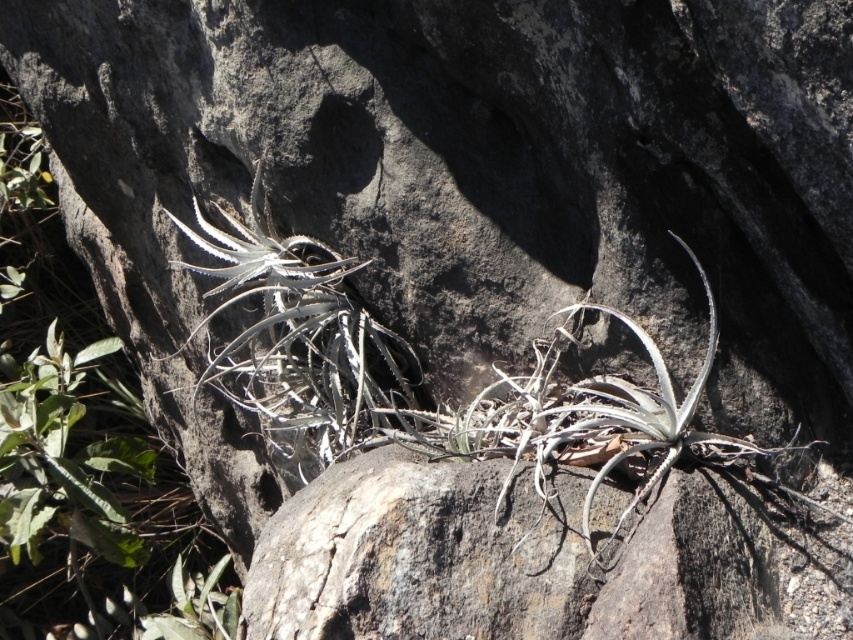
Looking at this image, between green leafy plant at left and gray/leathery airplant at center, which one has less height?

With less height is gray/leathery airplant at center.

Measure the distance between green leafy plant at left and gray/leathery airplant at center.

The distance of green leafy plant at left from gray/leathery airplant at center is 1.44 meters.

Measure the distance between point (132, 497) and camera.

Point (132, 497) and camera are 3.57 meters apart from each other.

Locate an element on the screen. green leafy plant at left is located at coordinates (82, 444).